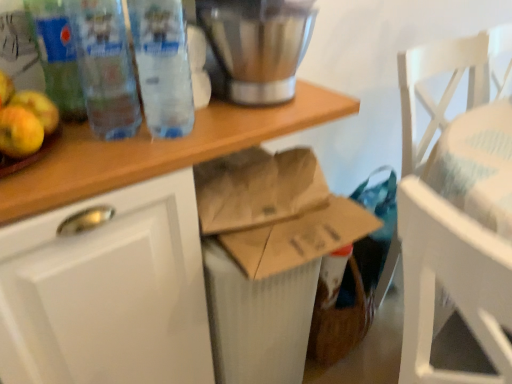
I want to click on vacant area located to the right-hand side of yellow matte apple at left, so click(117, 146).